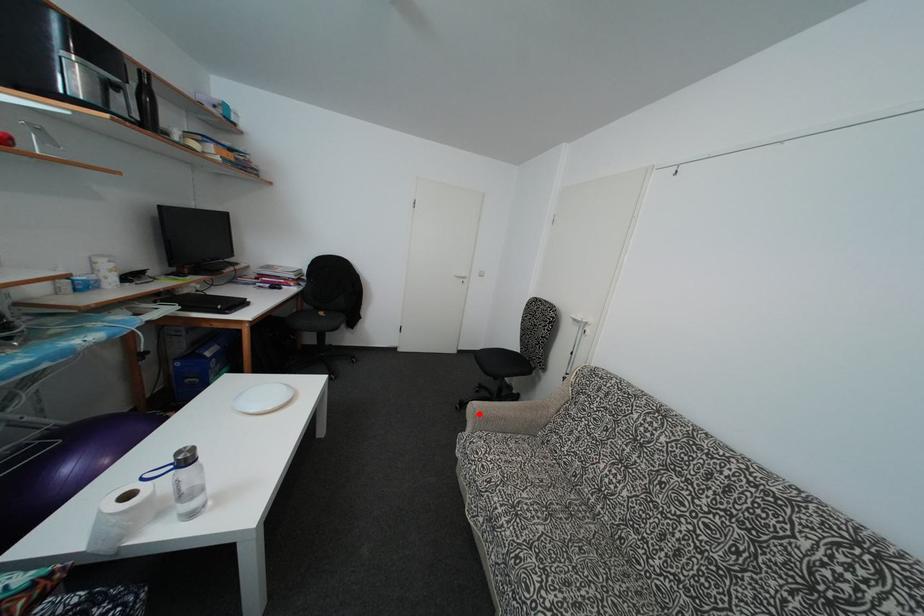
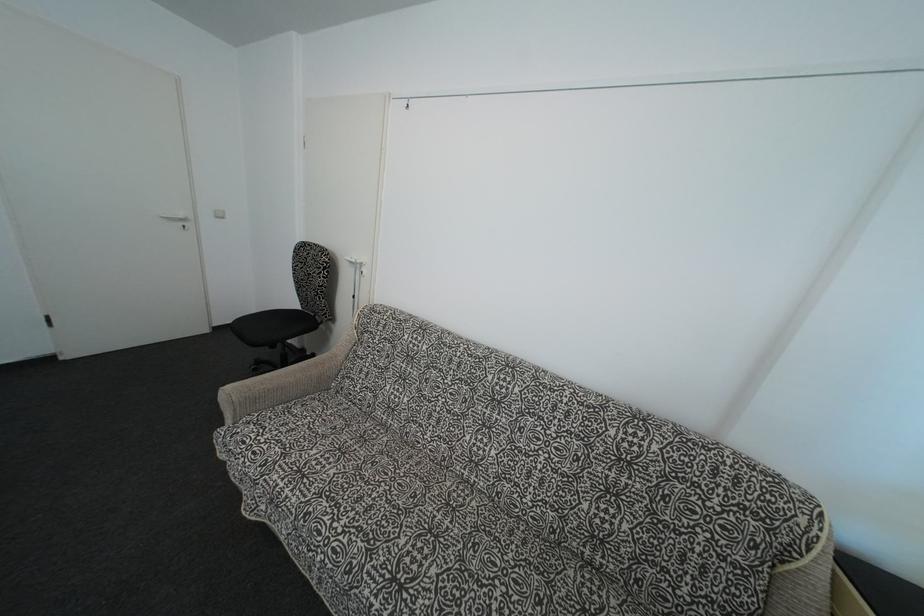
Question: I am providing you with two images of the same scene from different viewpoints. Image1 has a red point marked. In image2, the corresponding 3D location appears at what relative position? Reply with the corresponding letter.

Choices:
 (A) Closer
 (B) Farther

Answer: (B)